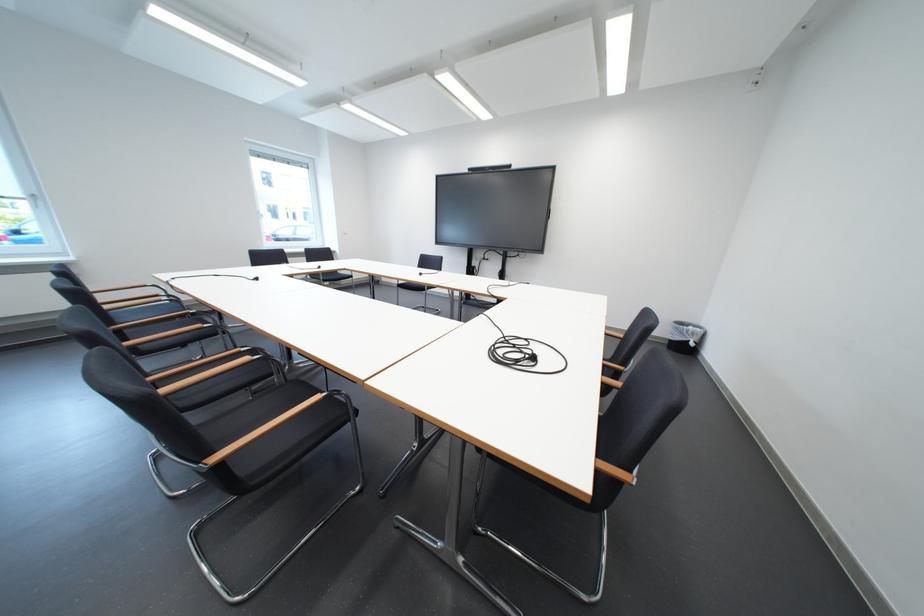
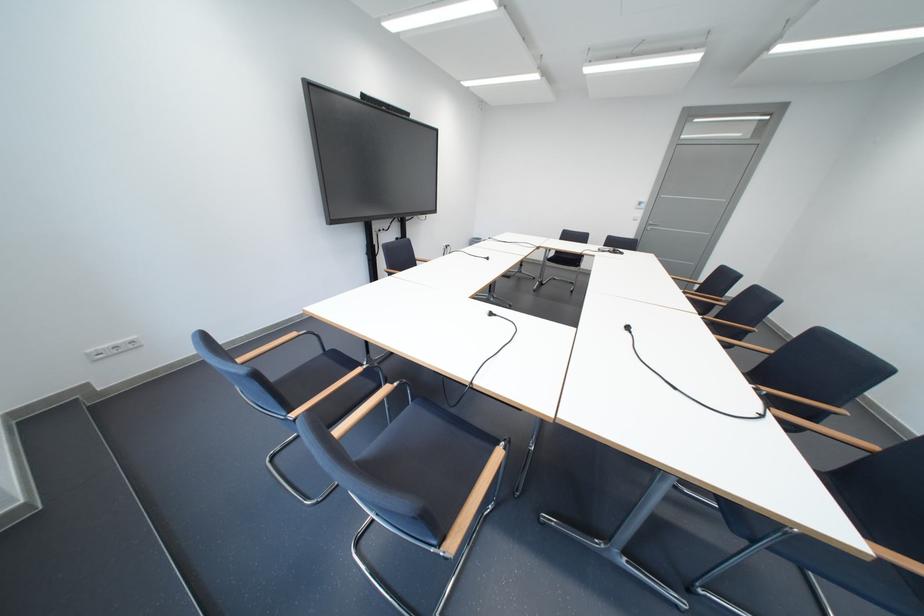
Locate, in the second image, the point that corresponds to point 332,270 in the first image.

(503, 315)